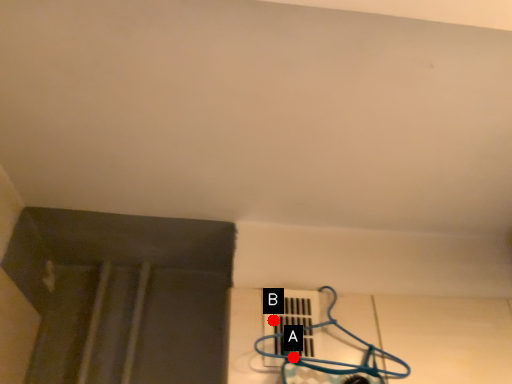
Question: Two points are circled on the image, labeled by A and B beside each circle. Among these points, which one is farthest from the camera?

Choices:
 (A) A is further
 (B) B is further

Answer: (B)